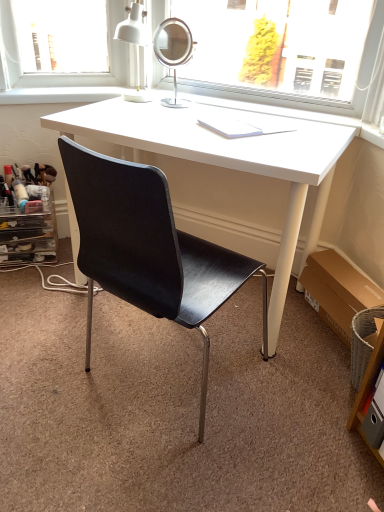
Identify the location of free spot below black leather chair at center (from a real-world perspective). (154, 373).